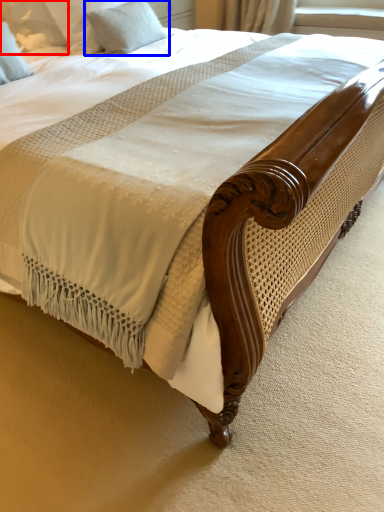
Question: Which object appears farthest to the camera in this image, pillow (highlighted by a red box) or pillow (highlighted by a blue box)?

Choices:
 (A) pillow
 (B) pillow

Answer: (B)